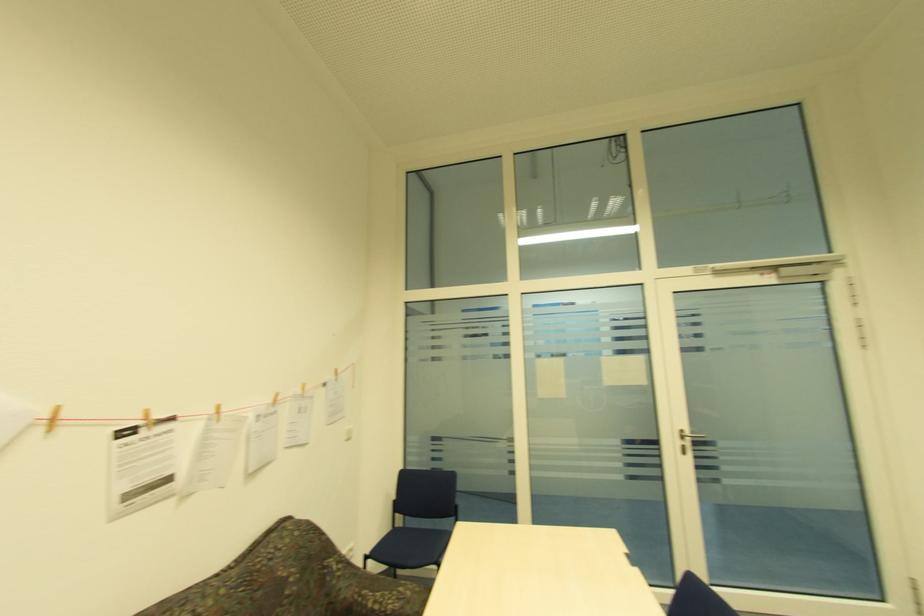
Find where to turn the door handle. Please return your answer as a coordinate pair (x, y).

(690, 436)